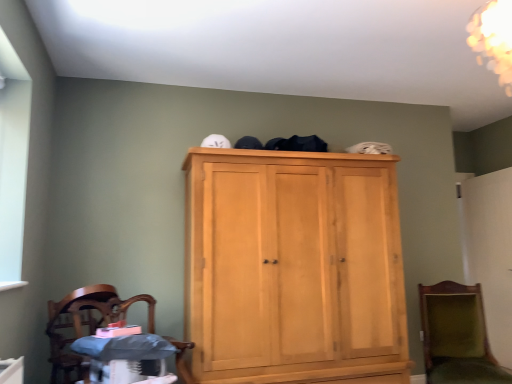
Question: Is matte gray changing table at lower left situated inside green velvet chair at lower right, which appears as the 2th chair when viewed from the left, or outside?

Choices:
 (A) outside
 (B) inside

Answer: (A)

Question: From a real-world perspective, relative to green velvet chair at lower right, which appears as the 2th chair when viewed from the left, is matte gray changing table at lower left vertically above or below?

Choices:
 (A) below
 (B) above

Answer: (B)

Question: Estimate the real-world distances between objects in this image. Which object is closer to the wooden polished chair at lower left, arranged as the 1th chair when viewed from the left?

Choices:
 (A) green velvet chair at lower right, which appears as the first chair when viewed from the back
 (B) light wood cupboard at center
 (C) matte gray changing table at lower left

Answer: (C)

Question: Which object is the farthest from the matte gray changing table at lower left?

Choices:
 (A) light wood cupboard at center
 (B) green velvet chair at lower right, which appears as the 2th chair when viewed from the left
 (C) wooden polished chair at lower left, which ranks as the first chair in front-to-back order

Answer: (B)